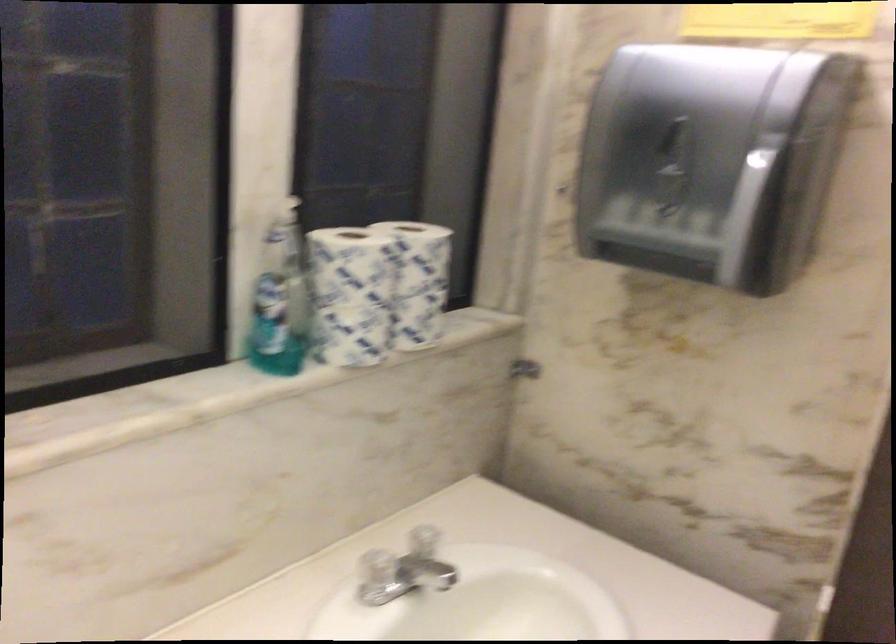
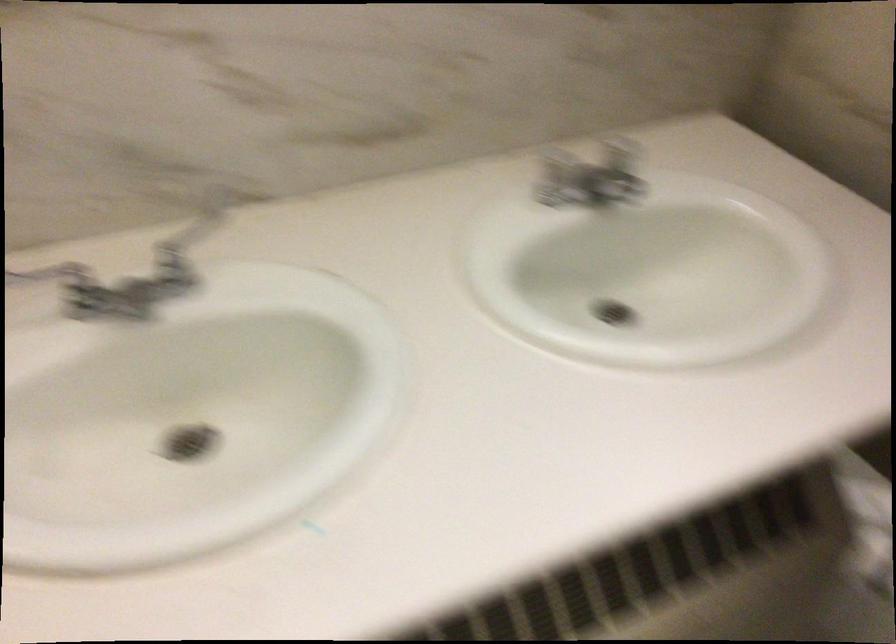
First-person continuous shooting, in which direction is the camera rotating?

The rotation direction of the camera is left-down.